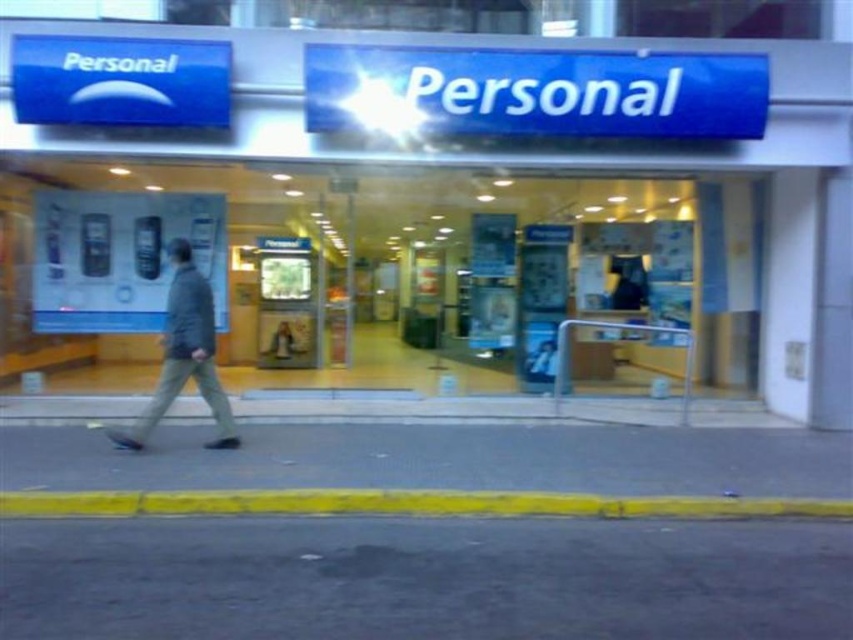
Question: Estimate the real-world distances between objects in this image. Which object is closer to the gray asphalt at lower center?

Choices:
 (A) dark gray asphalt at lower center
 (B) gray fabric jacket at left
 (C) blue plastic sign at upper center

Answer: (B)

Question: Which of the following is the closest to the observer?

Choices:
 (A) gray asphalt at lower center
 (B) blue plastic sign at upper center
 (C) gray fabric jacket at left

Answer: (C)

Question: Is blue plastic sign at upper center further to camera compared to gray fabric jacket at left?

Choices:
 (A) yes
 (B) no

Answer: (A)

Question: In this image, where is gray asphalt at lower center located relative to gray fabric jacket at left?

Choices:
 (A) above
 (B) below

Answer: (B)

Question: Among these objects, which one is farthest from the camera?

Choices:
 (A) gray asphalt at lower center
 (B) blue plastic sign at upper center
 (C) dark gray asphalt at lower center

Answer: (B)

Question: Can you confirm if gray asphalt at lower center is positioned to the left of gray fabric jacket at left?

Choices:
 (A) no
 (B) yes

Answer: (B)